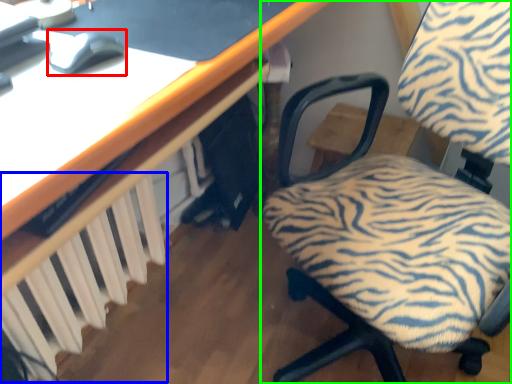
Question: Estimate the real-world distances between objects in this image. Which object is farther from mouse (highlighted by a red box), radiator (highlighted by a blue box) or chair (highlighted by a green box)?

Choices:
 (A) radiator
 (B) chair

Answer: (B)